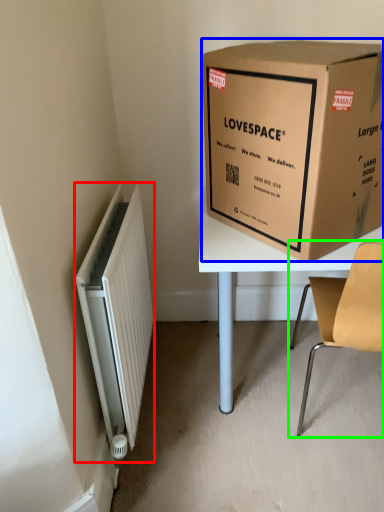
Question: Which object is the farthest from radiator (highlighted by a red box)? Choose among these: box (highlighted by a blue box) or chair (highlighted by a green box).

Choices:
 (A) box
 (B) chair

Answer: (B)